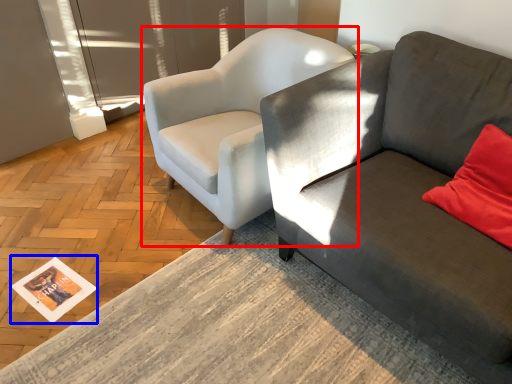
Question: Which point is further to the camera, chair (highlighted by a red box) or magazine (highlighted by a blue box)?

Choices:
 (A) chair
 (B) magazine

Answer: (B)